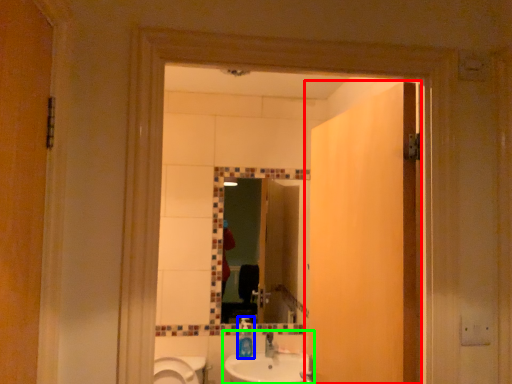
Question: Which is nearer to the door (highlighted by a red box)? bottle (highlighted by a blue box) or sink (highlighted by a green box).

Choices:
 (A) bottle
 (B) sink

Answer: (B)